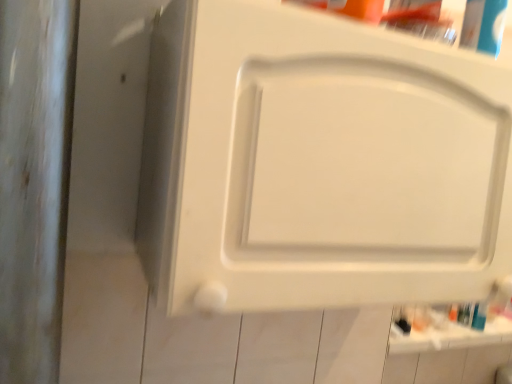
The image size is (512, 384). What do you see at coordinates (319, 163) in the screenshot? I see `white matte cabinet door at center` at bounding box center [319, 163].

The width and height of the screenshot is (512, 384). In order to click on white matte cabinet door at center in this screenshot , I will do `click(319, 163)`.

Locate an element on the screen. white matte cabinet door at center is located at coordinates (319, 163).